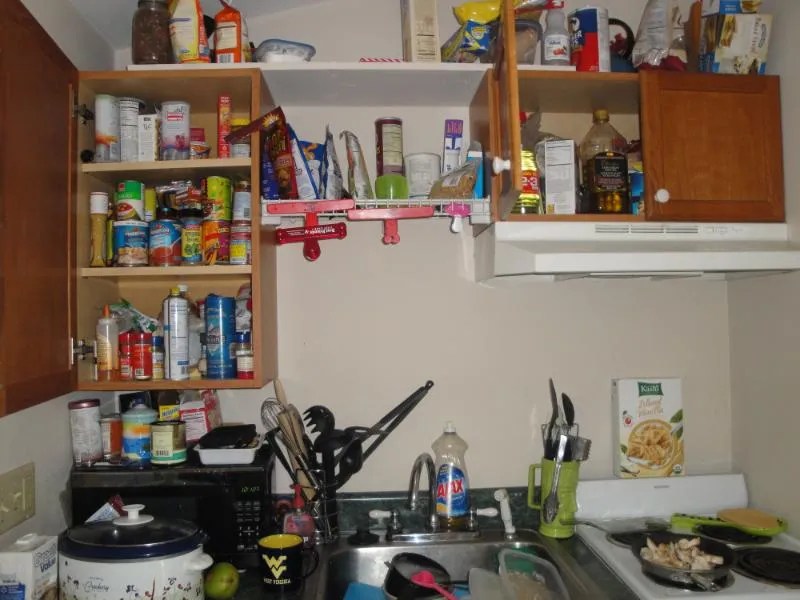
I want to click on doors, so click(x=737, y=147), click(x=510, y=92), click(x=45, y=202).